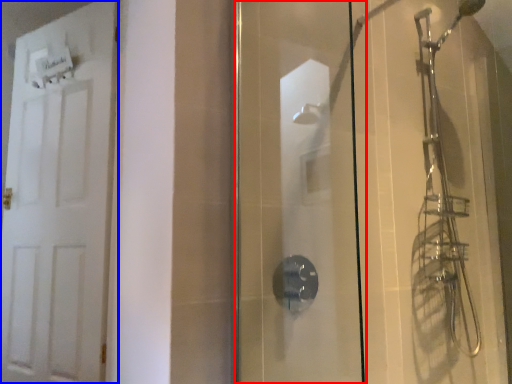
Question: Among these objects, which one is nearest to the camera, screen door (highlighted by a red box) or door (highlighted by a blue box)?

Choices:
 (A) screen door
 (B) door

Answer: (A)